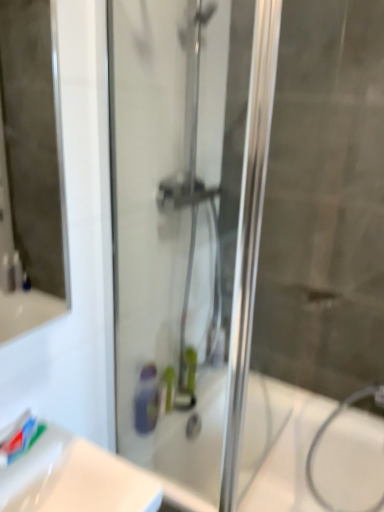
Question: Which is correct: white glossy sink at lower left is inside white matte toothpaste at lower left, or outside of it?

Choices:
 (A) outside
 (B) inside

Answer: (A)

Question: From a real-world perspective, relative to white matte toothpaste at lower left, is white glossy sink at lower left vertically above or below?

Choices:
 (A) below
 (B) above

Answer: (A)

Question: Estimate the real-world distances between objects in this image. Which object is farther from the white glossy bath at center?

Choices:
 (A) white matte toothpaste at lower left
 (B) white glossy sink at lower left
 (C) transparent glass shower door at center

Answer: (A)

Question: Which is farther from the white matte toothpaste at lower left?

Choices:
 (A) white glossy sink at lower left
 (B) transparent glass shower door at center
 (C) white glossy bath at center

Answer: (C)